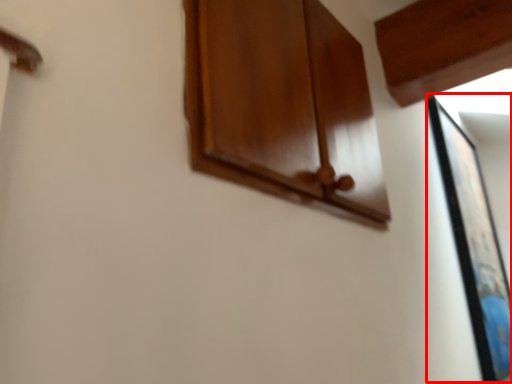
Question: From the image's perspective, what is the correct spatial relationship of picture frame (annotated by the red box) in relation to cabinetry?

Choices:
 (A) below
 (B) above

Answer: (A)